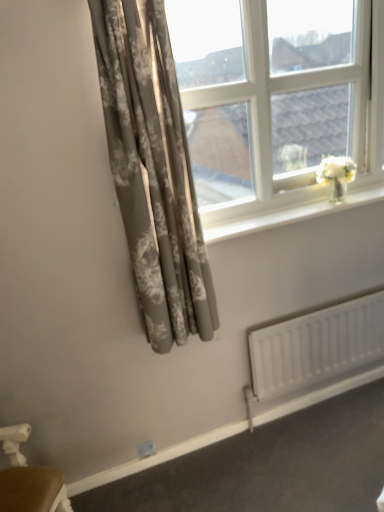
At what (x,y) coordinates should I click in order to perform the action: click on vacant location below white matte radiator at lower right (from a real-world perspective). Please return your answer as a coordinate pair (x, y). Image resolution: width=384 pixels, height=512 pixels. Looking at the image, I should click on (320, 406).